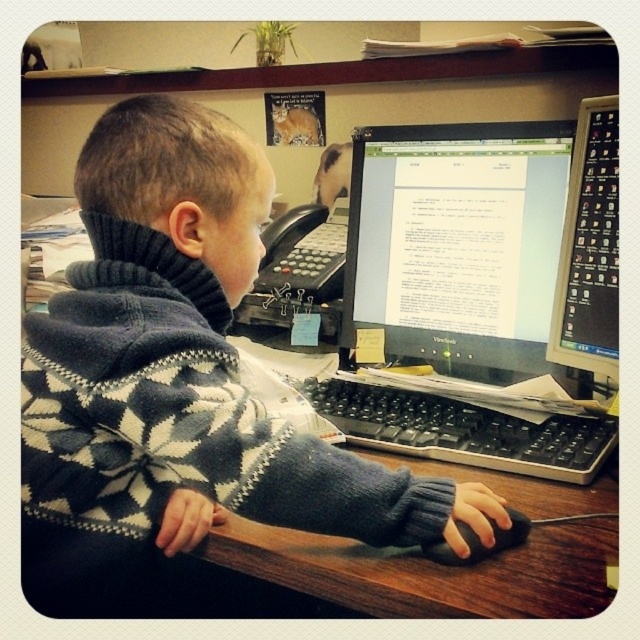
You are a teacher observing a student working at a desk. The student is wearing a dark blue sweater at center and using a black matte mouse at center. Which object is located more to the left?

The dark blue sweater at center is positioned on the left side of the black matte mouse at center, so it is more to the left.

You are a teacher observing a student working at their desk. You need to check if the student is using the mouse correctly. Which object is closer to the center of the desk, the matte black monitor at right or the black matte mouse at center?

The black matte mouse at center is closer to the center of the desk because the matte black monitor at right is positioned to its right side.